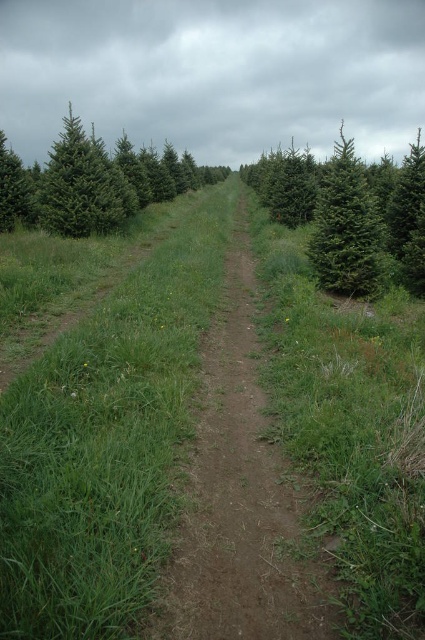
Question: Is green matte evergreen tree at center-right smaller than green matte tree at left?

Choices:
 (A) yes
 (B) no

Answer: (B)

Question: Which of the following is the closest to the observer?

Choices:
 (A) green matte evergreen tree at left
 (B) green matte tree at left
 (C) brown dirt track at center
 (D) green matte evergreen tree at right

Answer: (C)

Question: Estimate the real-world distances between objects in this image. Which object is closer to the green grassy at center?

Choices:
 (A) green matte evergreen tree at left
 (B) green matte evergreen tree at right
 (C) brown dirt track at center
 (D) green matte tree at left

Answer: (C)

Question: Is green grassy at center wider than brown dirt track at center?

Choices:
 (A) yes
 (B) no

Answer: (A)

Question: Can you confirm if brown dirt track at center is smaller than green matte tree at left?

Choices:
 (A) yes
 (B) no

Answer: (B)

Question: Which of the following is the farthest from the observer?

Choices:
 (A) (359, 509)
 (B) (133, 212)

Answer: (B)